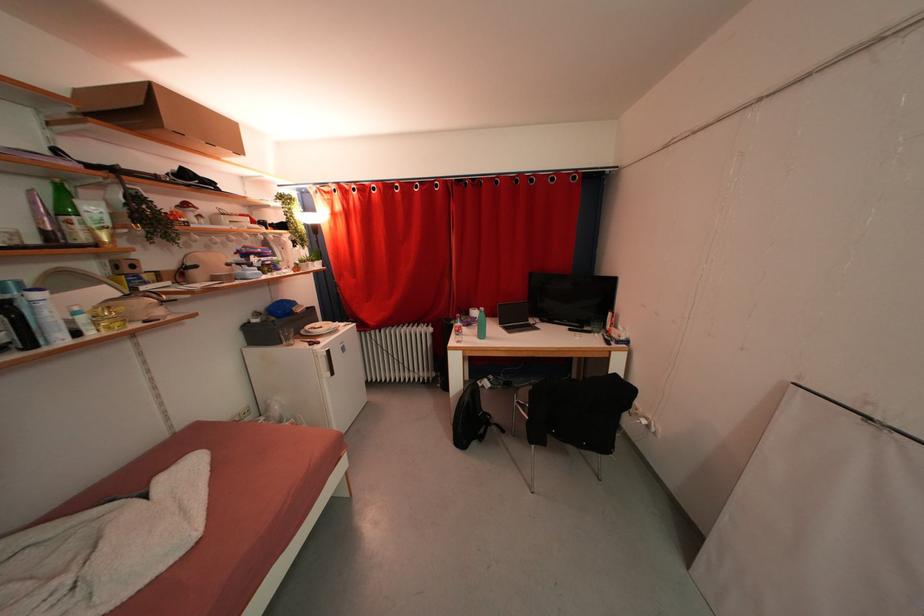
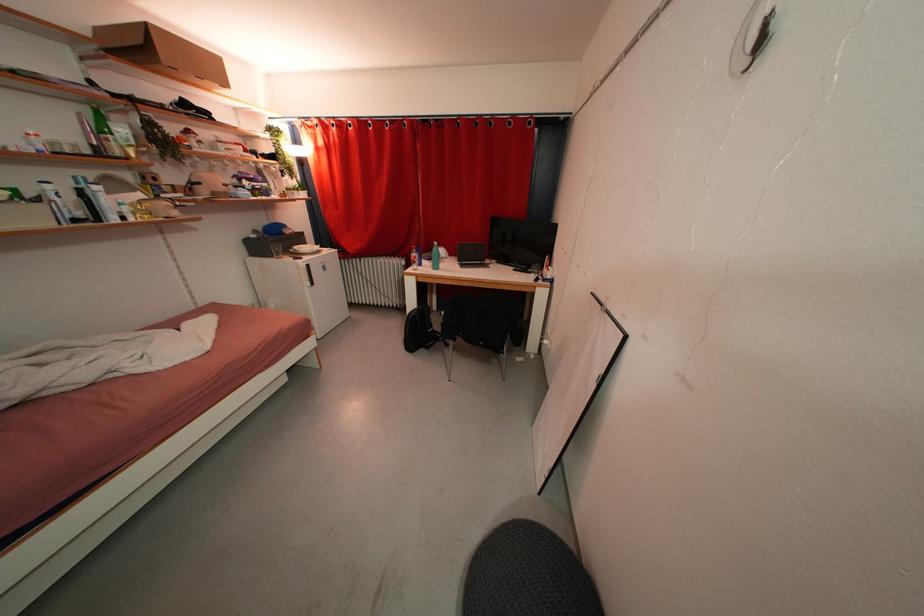
Where in the second image is the point corresponding to (x=322, y=351) from the first image?

(305, 265)